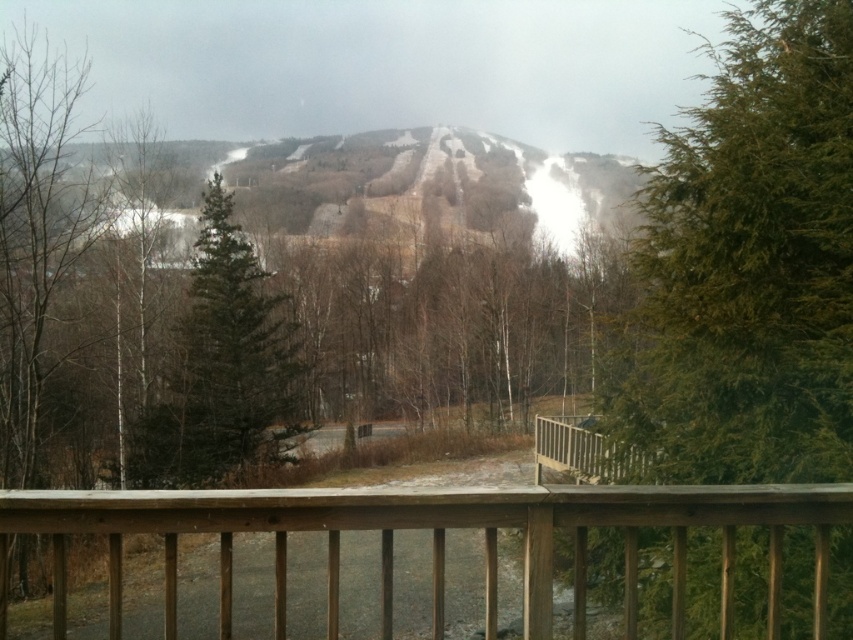
Is green needle-like tree at right further to camera compared to green matte tree at center?

No, it is in front of green matte tree at center.

Can you confirm if green needle-like tree at right is positioned to the left of green matte tree at center?

No, green needle-like tree at right is not to the left of green matte tree at center.

Does point (814, 438) come behind point (221, 332)?

That is False.

In order to click on green needle-like tree at right in this screenshot , I will do `click(747, 266)`.

Is brown wooden railing at center thinner than green matte tree at center?

Yes, brown wooden railing at center is thinner than green matte tree at center.

Image resolution: width=853 pixels, height=640 pixels. Identify the location of brown wooden railing at center. (433, 540).

Identify the location of brown wooden railing at center. The image size is (853, 640). (433, 540).

Can you confirm if green needle-like tree at right is bigger than brown wooden railing at center?

Yes, green needle-like tree at right is bigger than brown wooden railing at center.

In the scene shown: Does green needle-like tree at right have a lesser height compared to brown wooden railing at center?

No, green needle-like tree at right is not shorter than brown wooden railing at center.

Who is more distant from viewer, (782, 369) or (460, 490)?

The point (782, 369) is behind.

Identify the location of green needle-like tree at right. (747, 266).